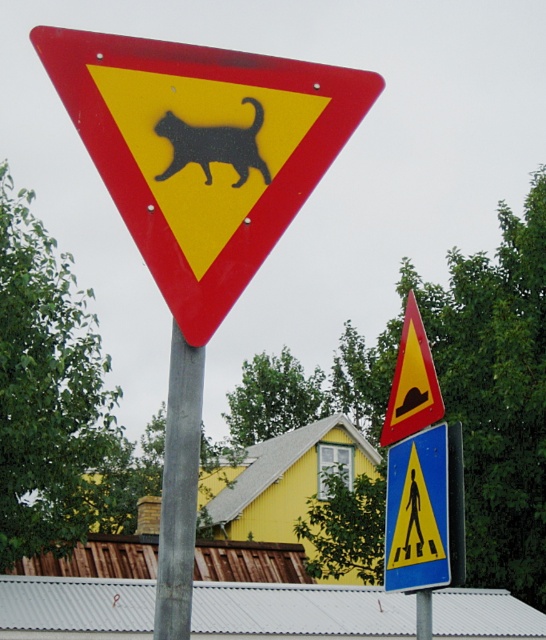
Question: Which of these objects is positioned closest to the yellow plastic pedestrian crossing sign at upper center?

Choices:
 (A) metallic pole at center
 (B) metallic yellow hazard at center
 (C) metallic red triangle at upper center

Answer: (B)

Question: Is metallic pole at center further to camera compared to metallic yellow hazard at center?

Choices:
 (A) yes
 (B) no

Answer: (B)

Question: Is metallic red triangle at upper center wider than metallic yellow hazard at center?

Choices:
 (A) no
 (B) yes

Answer: (A)

Question: Can you confirm if metallic pole at center is thinner than yellow plastic pedestrian crossing sign at upper center?

Choices:
 (A) yes
 (B) no

Answer: (B)

Question: Which is nearer to the metallic pole at center?

Choices:
 (A) metallic yellow hazard at center
 (B) metallic red triangle at upper center

Answer: (B)

Question: Which point appears closest to the camera in this image?

Choices:
 (A) (169, 397)
 (B) (225, 280)

Answer: (B)